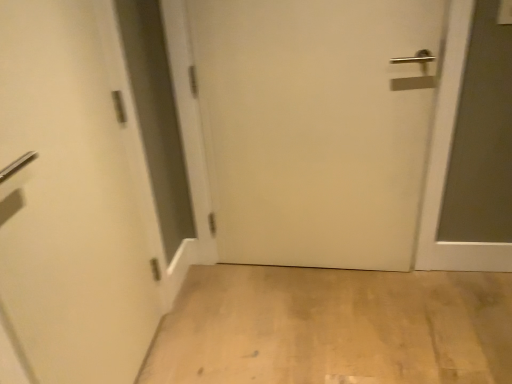
In order to face white matte door at center, positioned as the first door in right-to-left order, should I rotate leftwards or rightwards?

Turn right by 7.748 degrees to look at white matte door at center, positioned as the first door in right-to-left order.

What do you see at coordinates (316, 127) in the screenshot? The image size is (512, 384). I see `white matte door at center, which appears as the second door when viewed from the left` at bounding box center [316, 127].

In order to click on white matte door at left, placed as the second door when sorted from right to left in this screenshot , I will do `click(71, 199)`.

The height and width of the screenshot is (384, 512). What are the coordinates of `light wood floor at lower center` in the screenshot? It's located at (334, 327).

Which is more to the left, white matte door at center, which appears as the second door when viewed from the left, or light wood floor at lower center?

white matte door at center, which appears as the second door when viewed from the left, is more to the left.

Which point is more distant from viewer, (280, 213) or (190, 325)?

The point (280, 213) is farther.

Is light wood floor at lower center at the back of white matte door at center, which appears as the second door when viewed from the left?

white matte door at center, which appears as the second door when viewed from the left, is not turned away from light wood floor at lower center.

Who is shorter, white matte door at center, which appears as the second door when viewed from the left, or light wood floor at lower center?

light wood floor at lower center is shorter.

Can you confirm if light wood floor at lower center is thinner than white matte door at center, positioned as the first door in right-to-left order?

No.

Considering the relative positions of light wood floor at lower center and white matte door at center, positioned as the first door in right-to-left order, in the image provided, is light wood floor at lower center to the left of white matte door at center, positioned as the first door in right-to-left order, from the viewer's perspective?

Incorrect, light wood floor at lower center is not on the left side of white matte door at center, positioned as the first door in right-to-left order.

From the image's perspective, which is above, light wood floor at lower center or white matte door at center, which appears as the second door when viewed from the left?

From the image's view, white matte door at center, which appears as the second door when viewed from the left, is above.

Does point (333, 295) appear closer or farther from the camera than point (338, 203)?

Point (333, 295) appears to be farther away from the viewer than point (338, 203).

Consider the image. Considering the relative positions of white matte door at left, which appears as the 1th door when viewed from the left, and white matte door at center, which appears as the second door when viewed from the left, in the image provided, is white matte door at left, which appears as the 1th door when viewed from the left, to the left of white matte door at center, which appears as the second door when viewed from the left, from the viewer's perspective?

Indeed, white matte door at left, which appears as the 1th door when viewed from the left, is positioned on the left side of white matte door at center, which appears as the second door when viewed from the left.

Can you confirm if white matte door at left, which appears as the 1th door when viewed from the left, is wider than white matte door at center, positioned as the first door in right-to-left order?

Incorrect, the width of white matte door at left, which appears as the 1th door when viewed from the left, does not surpass that of white matte door at center, positioned as the first door in right-to-left order.

Which of these two, white matte door at left, placed as the second door when sorted from right to left, or white matte door at center, which appears as the second door when viewed from the left, is smaller?

Smaller between the two is white matte door at left, placed as the second door when sorted from right to left.

Is white matte door at left, which appears as the 1th door when viewed from the left, completely or partially inside white matte door at center, which appears as the second door when viewed from the left?

Actually, white matte door at left, which appears as the 1th door when viewed from the left, is outside white matte door at center, which appears as the second door when viewed from the left.

Between white matte door at center, which appears as the second door when viewed from the left, and white matte door at left, which appears as the 1th door when viewed from the left, which one has less height?

white matte door at center, which appears as the second door when viewed from the left.

From the image's perspective, is white matte door at center, positioned as the first door in right-to-left order, below white matte door at left, placed as the second door when sorted from right to left?

No.

Considering the relative positions of white matte door at center, which appears as the second door when viewed from the left, and white matte door at left, which appears as the 1th door when viewed from the left, in the image provided, is white matte door at center, which appears as the second door when viewed from the left, to the right of white matte door at left, which appears as the 1th door when viewed from the left, from the viewer's perspective?

Yes, white matte door at center, which appears as the second door when viewed from the left, is to the right of white matte door at left, which appears as the 1th door when viewed from the left.

Can we say white matte door at left, which appears as the 1th door when viewed from the left, lies outside light wood floor at lower center?

white matte door at left, which appears as the 1th door when viewed from the left, lies outside light wood floor at lower center's area.

Locate an element on the screen. Image resolution: width=512 pixels, height=384 pixels. corridor below the white matte door at left, which appears as the 1th door when viewed from the left (from the image's perspective) is located at coordinates (x=334, y=327).

Is white matte door at left, placed as the second door when sorted from right to left, next to light wood floor at lower center?

No, white matte door at left, placed as the second door when sorted from right to left, is not touching light wood floor at lower center.

Relative to light wood floor at lower center, is white matte door at left, placed as the second door when sorted from right to left, in front or behind?

In the image, white matte door at left, placed as the second door when sorted from right to left, appears in front of light wood floor at lower center.

Does point (206, 377) lie in front of point (63, 57)?

No, (206, 377) is further to viewer.

Is light wood floor at lower center at the right side of white matte door at left, placed as the second door when sorted from right to left?

Yes, light wood floor at lower center is to the right of white matte door at left, placed as the second door when sorted from right to left.

How different are the orientations of light wood floor at lower center and white matte door at left, which appears as the 1th door when viewed from the left, in degrees?

180 degrees separate the facing orientations of light wood floor at lower center and white matte door at left, which appears as the 1th door when viewed from the left.

Is the depth of light wood floor at lower center greater than that of white matte door at left, placed as the second door when sorted from right to left?

Yes, light wood floor at lower center is further from the viewer.

Where is `corridor in front of the white matte door at center, positioned as the first door in right-to-left order`? Image resolution: width=512 pixels, height=384 pixels. corridor in front of the white matte door at center, positioned as the first door in right-to-left order is located at coordinates (334, 327).

At what (x,y) coordinates should I click in order to perform the action: click on door that is the 2nd object located above the light wood floor at lower center (from the image's perspective). Please return your answer as a coordinate pair (x, y). The image size is (512, 384). Looking at the image, I should click on (316, 127).

Considering their positions, is white matte door at left, placed as the second door when sorted from right to left, positioned closer to light wood floor at lower center than white matte door at center, positioned as the first door in right-to-left order?

Among the two, white matte door at center, positioned as the first door in right-to-left order, is located nearer to light wood floor at lower center.

From the image, which object appears to be nearer to white matte door at center, which appears as the second door when viewed from the left, light wood floor at lower center or white matte door at left, placed as the second door when sorted from right to left?

light wood floor at lower center is positioned closer to the anchor white matte door at center, which appears as the second door when viewed from the left.

Looking at the image, which one is located further to white matte door at left, which appears as the 1th door when viewed from the left, light wood floor at lower center or white matte door at center, positioned as the first door in right-to-left order?

light wood floor at lower center.

Which object lies nearer to the anchor point light wood floor at lower center, white matte door at center, positioned as the first door in right-to-left order, or white matte door at left, placed as the second door when sorted from right to left?

Based on the image, white matte door at center, positioned as the first door in right-to-left order, appears to be nearer to light wood floor at lower center.

When comparing their distances from white matte door at center, positioned as the first door in right-to-left order, does white matte door at left, placed as the second door when sorted from right to left, or light wood floor at lower center seem further?

white matte door at left, placed as the second door when sorted from right to left, is further to white matte door at center, positioned as the first door in right-to-left order.

Based on their spatial positions, is white matte door at center, positioned as the first door in right-to-left order, or light wood floor at lower center closer to white matte door at left, which appears as the 1th door when viewed from the left?

white matte door at center, positioned as the first door in right-to-left order, lies closer to white matte door at left, which appears as the 1th door when viewed from the left, than the other object.

At what (x,y) coordinates should I click in order to perform the action: click on door between white matte door at left, placed as the second door when sorted from right to left, and light wood floor at lower center, in the horizontal direction. Please return your answer as a coordinate pair (x, y). Looking at the image, I should click on (316, 127).